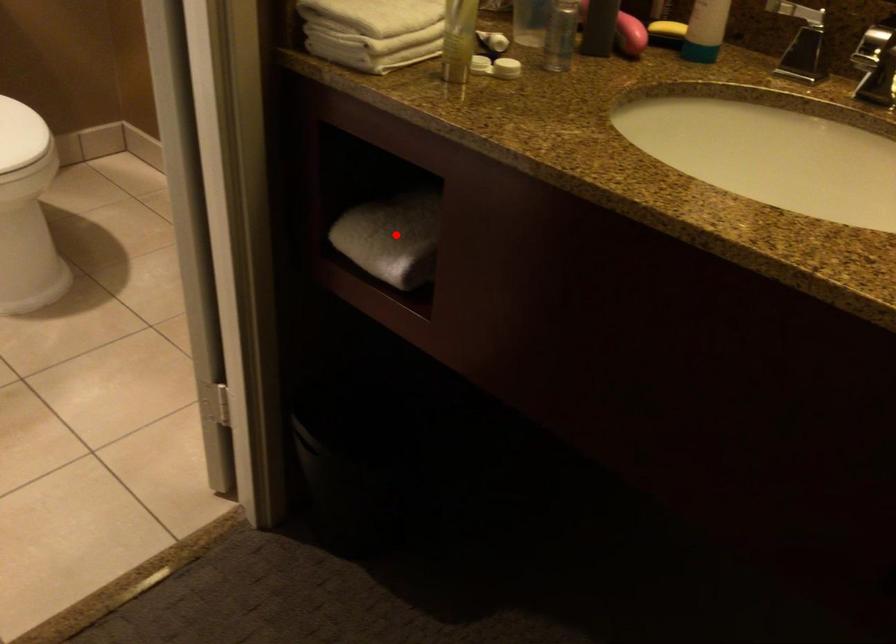
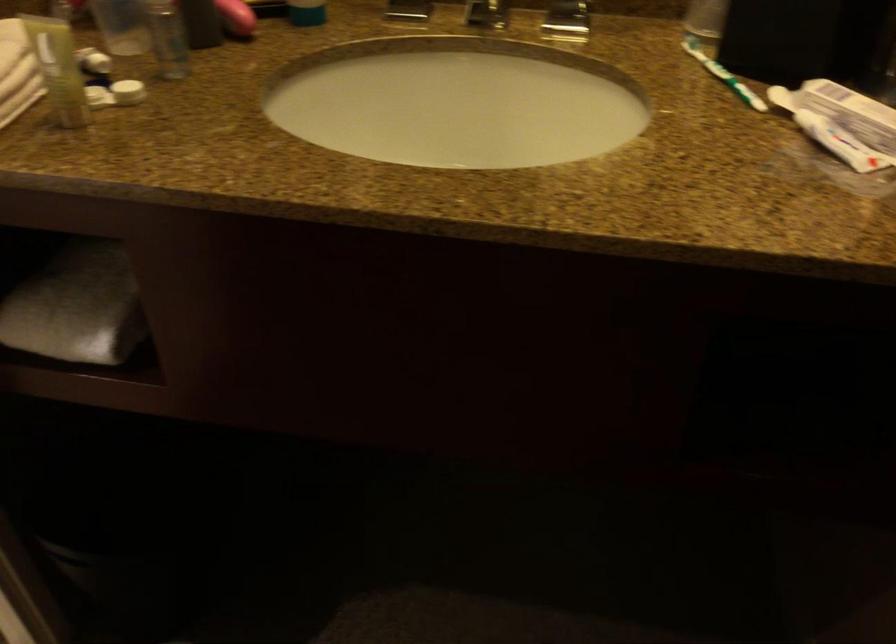
Find the pixel in the second image that matches the highlighted location in the first image.

(76, 306)